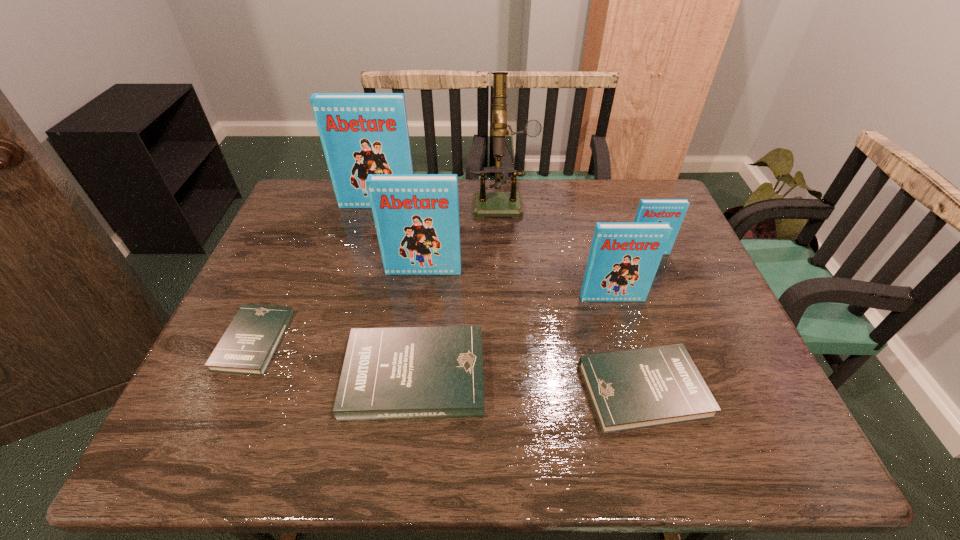
Locate which object ranks second in proximity to the farthest blue book. Please provide its 2D coordinates. Your answer should be formatted as a tuple, i.e. [(x, y)], where the tuple contains the x and y coordinates of a point satisfying the conditions above.

[(416, 216)]

This screenshot has height=540, width=960. What are the coordinates of `book identified as the third closest to the microscope` in the screenshot? It's located at (673, 211).

Locate an element on the screen. The width and height of the screenshot is (960, 540). book that is the third closest to the third tallest object is located at coordinates (361, 133).

Point out which blue book is positioned as the second nearest to the fifth shortest book. Please provide its 2D coordinates. Your answer should be formatted as a tuple, i.e. [(x, y)], where the tuple contains the x and y coordinates of a point satisfying the conditions above.

[(416, 216)]

Identify the location of the second closest blue book to the leftmost book. (361, 133).

Select which dark book is the closest to the third nearest blue book. Please provide its 2D coordinates. Your answer should be formatted as a tuple, i.e. [(x, y)], where the tuple contains the x and y coordinates of a point satisfying the conditions above.

[(632, 389)]

Locate which dark book ranks second in proximity to the third tallest object. Please provide its 2D coordinates. Your answer should be formatted as a tuple, i.e. [(x, y)], where the tuple contains the x and y coordinates of a point satisfying the conditions above.

[(250, 341)]

Locate an element on the screen. This screenshot has height=540, width=960. blank area in the image that satisfies the following two spatial constraints: 1. on the front cover of the third farthest blue book; 2. on the right side of the seventh tallest object is located at coordinates (408, 390).

Locate an element on the screen. This screenshot has width=960, height=540. vacant space that satisfies the following two spatial constraints: 1. on the front side of the second dark book from left to right; 2. on the right side of the leftmost dark book is located at coordinates (239, 375).